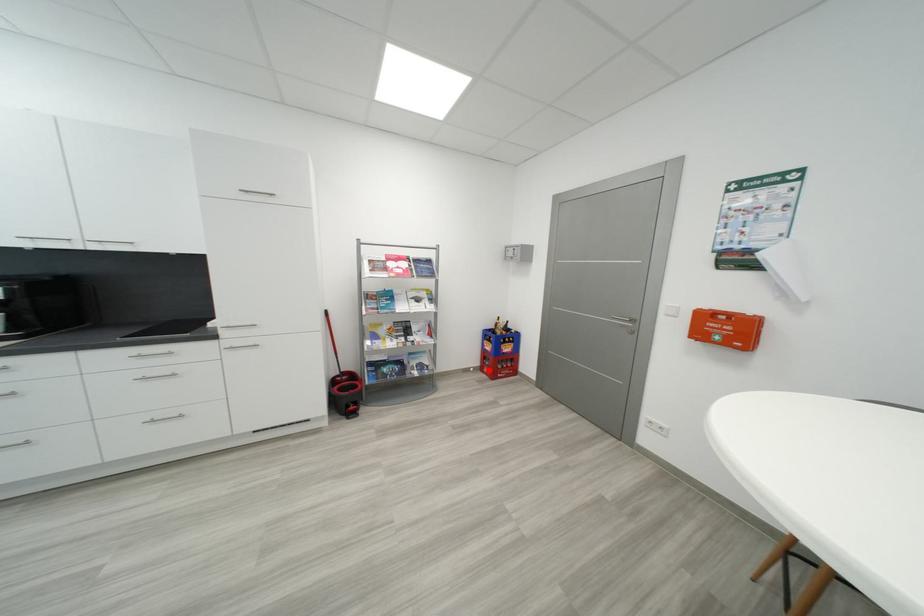
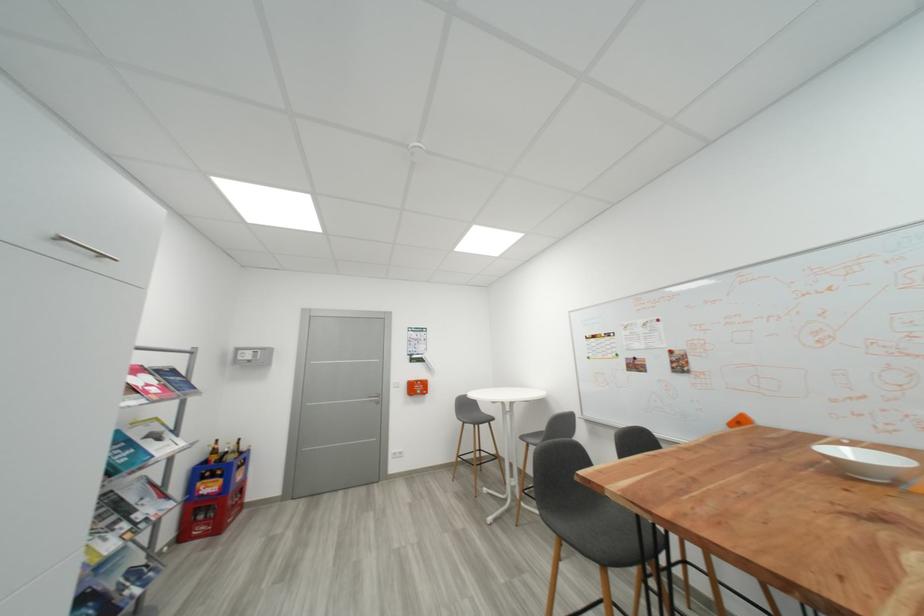
Locate, in the second image, the point that corresponds to the highlighted location in the first image.

(189, 538)